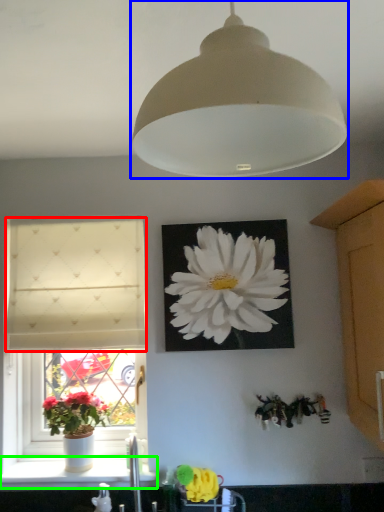
Question: Which object is the farthest from curtain (highlighted by a red box)? Choose among these: lamp (highlighted by a blue box) or window sill (highlighted by a green box).

Choices:
 (A) lamp
 (B) window sill

Answer: (A)